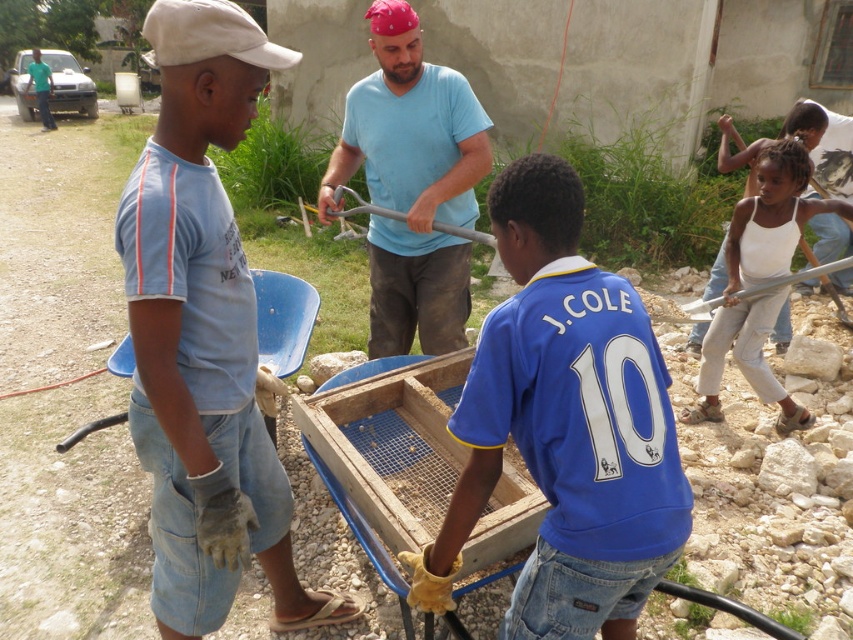
You are a photographer trying to capture a group photo of the children in the scene. You need to arrange them so that the blue jersey at center is positioned to the left of the white cotton tank top at right. Is this arrangement already correct as shown in the image?

Yes, the blue jersey at center is already positioned to the left of the white cotton tank top at right as required.

You are a photographer trying to capture the blue jersey at center. Where should you focus your camera to ensure the point at point (x=564, y=426) is in the frame?

The point (x=564, y=426) is on the blue jersey at center, so you should focus your camera on the blue jersey at center to ensure the point is in the frame.